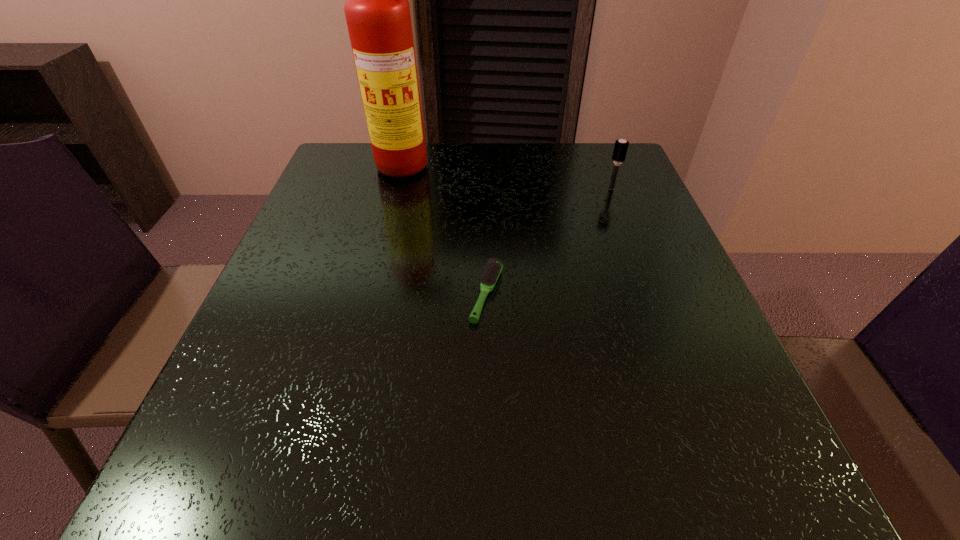
Find the location of a particular element. hairbrush at the far edge is located at coordinates 620,149.

Find the location of a particular element. object that is positioned at the left edge is located at coordinates (377, 11).

Locate an element on the screen. The image size is (960, 540). object located at the right edge is located at coordinates (620, 149).

The width and height of the screenshot is (960, 540). I want to click on object at the far left corner, so click(377, 11).

At what (x,y) coordinates should I click in order to perform the action: click on object at the far right corner. Please return your answer as a coordinate pair (x, y). Looking at the image, I should click on (620, 149).

Where is `vacant region at the far edge of the desktop`? The width and height of the screenshot is (960, 540). vacant region at the far edge of the desktop is located at coordinates (557, 157).

In the image, there is a desktop. Identify the location of free space at the left edge. This screenshot has height=540, width=960. (254, 361).

This screenshot has width=960, height=540. In order to click on vacant space at the right edge of the desktop in this screenshot , I will do `click(615, 245)`.

I want to click on blank space at the far left corner of the desktop, so click(x=363, y=170).

This screenshot has height=540, width=960. Identify the location of vacant space at the near left corner of the desktop. (301, 474).